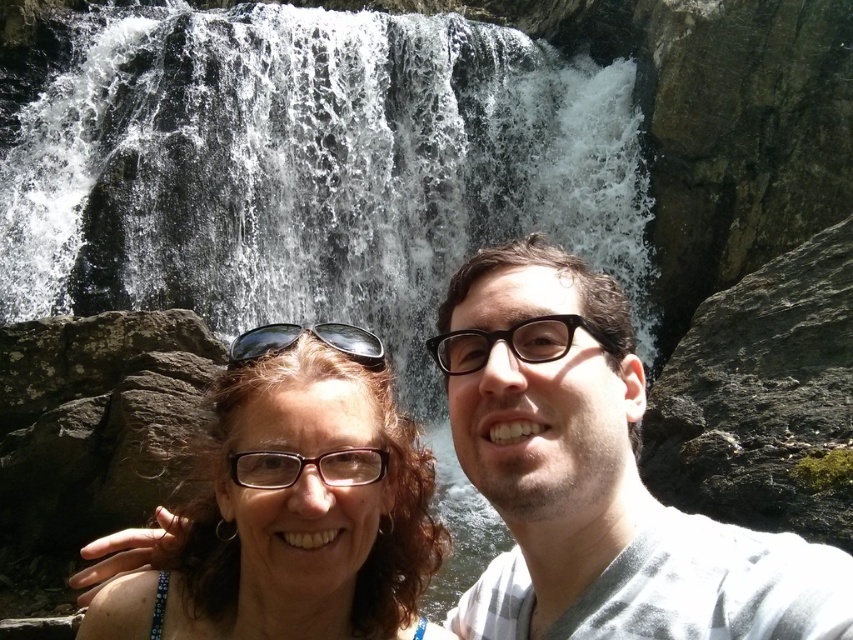
You are a photographer trying to focus on the smooth gray shirt at center and the black reflective sunglasses at center. Which object should you adjust your focus to first if you want to capture both clearly in the same frame?

The smooth gray shirt at center is above the black reflective sunglasses at center, so you should focus on the smooth gray shirt at center first as it is closer to the camera.

Looking at the two people in the selfie, which object is positioned more to the right between the matte brown hair at center and the black reflective sunglasses at center?

The matte brown hair at center is to the right of the black reflective sunglasses at center.